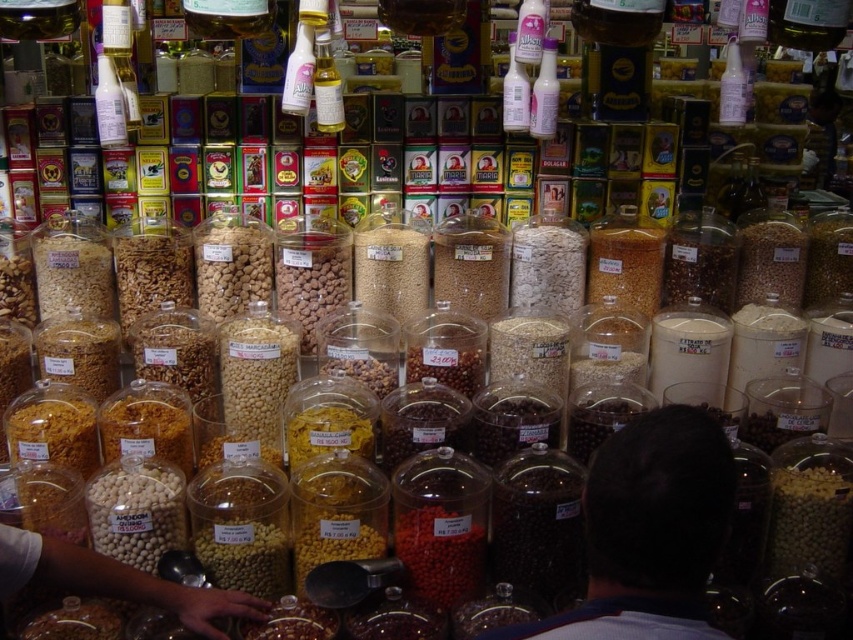
Question: Which of the following is the farthest from the observer?

Choices:
 (A) (328, 109)
 (B) (656, 620)

Answer: (A)

Question: Does dark brown hair at center appear under translucent plastic bottle at center?

Choices:
 (A) no
 (B) yes

Answer: (B)

Question: Can you confirm if dark brown hair at center is positioned above translucent plastic bottle at center?

Choices:
 (A) no
 (B) yes

Answer: (A)

Question: Among these points, which one is nearest to the camera?

Choices:
 (A) (631, 445)
 (B) (325, 32)

Answer: (A)

Question: Which object appears farthest from the camera in this image?

Choices:
 (A) translucent plastic bottle at center
 (B) dark brown hair at center

Answer: (A)

Question: Does dark brown hair at center have a lesser width compared to translucent plastic bottle at center?

Choices:
 (A) yes
 (B) no

Answer: (B)